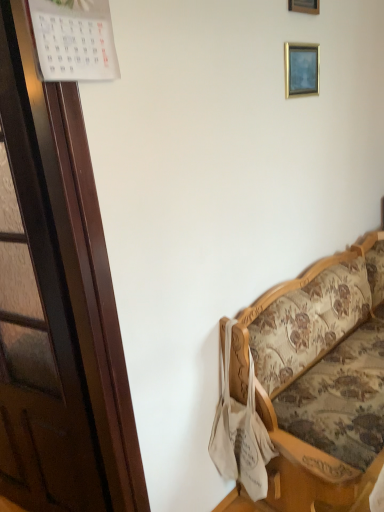
Question: Is wooden picture frame at upper center, which is the first picture frame from top to bottom, situated inside gold metallic picture frame at upper right, which is the 1th picture frame from bottom to top, or outside?

Choices:
 (A) inside
 (B) outside

Answer: (B)

Question: In the image, is wooden picture frame at upper center, acting as the 2th picture frame starting from the bottom, positioned in front of or behind gold metallic picture frame at upper right, which is the 1th picture frame from bottom to top?

Choices:
 (A) front
 (B) behind

Answer: (A)

Question: Which object is positioned closest to the wooden picture frame at upper center, which is the first picture frame from top to bottom?

Choices:
 (A) floral fabric couch at right
 (B) gold metallic picture frame at upper right, placed as the second picture frame when sorted from top to bottom

Answer: (B)

Question: Which object is the closest to the floral fabric couch at right?

Choices:
 (A) wooden picture frame at upper center, acting as the 2th picture frame starting from the bottom
 (B) gold metallic picture frame at upper right, which is the 1th picture frame from bottom to top

Answer: (B)